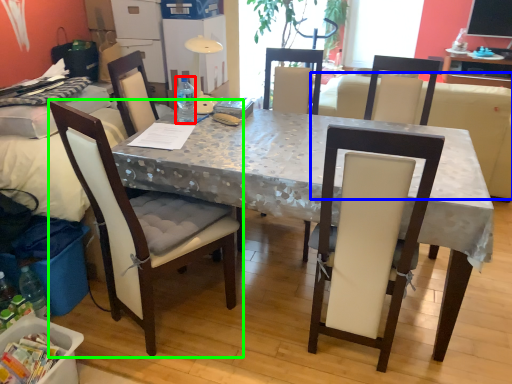
Question: Considering the real-world distances, which object is farthest from bottle (highlighted by a red box)? couch (highlighted by a blue box) or chair (highlighted by a green box)?

Choices:
 (A) couch
 (B) chair

Answer: (A)